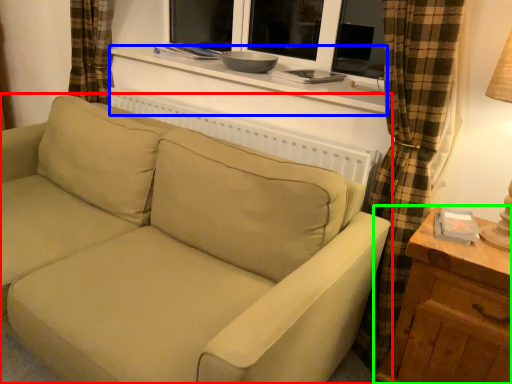
Question: Which object is positioned closest to studio couch (highlighted by a red box)? Select from window sill (highlighted by a blue box) and table (highlighted by a green box).

Choices:
 (A) window sill
 (B) table

Answer: (B)